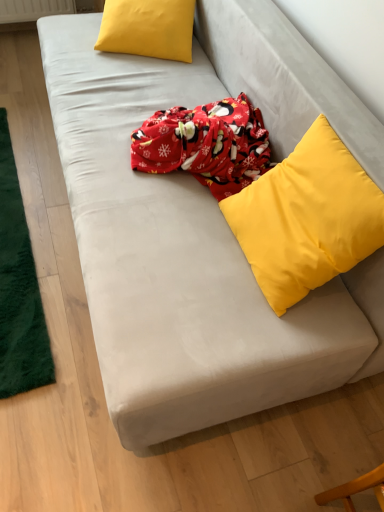
Question: Is green plush mat at left completely or partially outside of matte yellow pillow at upper left, marked as the 2th pillow in a right-to-left arrangement?

Choices:
 (A) yes
 (B) no

Answer: (A)

Question: Is matte yellow pillow at upper left, which is counted as the 2th pillow, starting from the bottom, surrounded by green plush mat at left?

Choices:
 (A) no
 (B) yes

Answer: (A)

Question: Is green plush mat at left facing away from matte yellow pillow at upper left, which appears as the first pillow when viewed from the top?

Choices:
 (A) yes
 (B) no

Answer: (B)

Question: Does green plush mat at left lie behind matte yellow pillow at upper left, the 1th pillow from the back?

Choices:
 (A) no
 (B) yes

Answer: (A)

Question: From a real-world perspective, is green plush mat at left under matte yellow pillow at upper left, marked as the 2th pillow in a right-to-left arrangement?

Choices:
 (A) yes
 (B) no

Answer: (A)

Question: From the image's perspective, is yellow matte pillow at upper right, the second pillow viewed from the back, above or below matte yellow pillow at upper left, which appears as the first pillow when viewed from the top?

Choices:
 (A) below
 (B) above

Answer: (A)

Question: Is yellow matte pillow at upper right, the first pillow in the bottom-to-top sequence, taller or shorter than matte yellow pillow at upper left, which ranks as the second pillow in front-to-back order?

Choices:
 (A) short
 (B) tall

Answer: (B)

Question: Is yellow matte pillow at upper right, which ranks as the first pillow in right-to-left order, in front of or behind matte yellow pillow at upper left, which ranks as the second pillow in front-to-back order, in the image?

Choices:
 (A) front
 (B) behind

Answer: (A)

Question: From a real-world perspective, relative to matte yellow pillow at upper left, which is counted as the 2th pillow, starting from the bottom, is yellow matte pillow at upper right, the second pillow viewed from the back, vertically above or below?

Choices:
 (A) above
 (B) below

Answer: (A)

Question: In terms of width, does green plush mat at left look wider or thinner when compared to matte yellow pillow at upper left, the 1th pillow from the back?

Choices:
 (A) thin
 (B) wide

Answer: (B)

Question: From the image's perspective, relative to matte yellow pillow at upper left, marked as the 2th pillow in a right-to-left arrangement, is green plush mat at left above or below?

Choices:
 (A) above
 (B) below

Answer: (B)

Question: Considering the positions of green plush mat at left and matte yellow pillow at upper left, which appears as the first pillow when viewed from the top, in the image, is green plush mat at left taller or shorter than matte yellow pillow at upper left, which appears as the first pillow when viewed from the top,?

Choices:
 (A) tall
 (B) short

Answer: (B)

Question: Do you think green plush mat at left is within matte yellow pillow at upper left, marked as the 2th pillow in a right-to-left arrangement, or outside of it?

Choices:
 (A) outside
 (B) inside

Answer: (A)

Question: In the image, is matte yellow pillow at upper left, which is counted as the 2th pillow, starting from the bottom, on the left side or the right side of green plush mat at left?

Choices:
 (A) left
 (B) right

Answer: (B)

Question: From a real-world perspective, is matte yellow pillow at upper left, which appears as the first pillow when viewed from the top, positioned above or below green plush mat at left?

Choices:
 (A) above
 (B) below

Answer: (A)